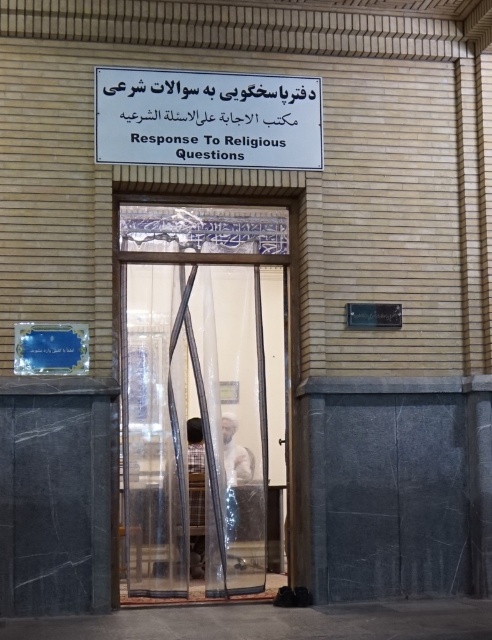
Question: Is transparent mesh door at center to the right of light brown wooden chair at center from the viewer's perspective?

Choices:
 (A) no
 (B) yes

Answer: (B)

Question: Among these points, which one is farthest from the camera?

Choices:
 (A) (234, 435)
 (B) (187, 420)

Answer: (B)

Question: Among these points, which one is nearest to the camera?

Choices:
 (A) (303, 113)
 (B) (236, 301)

Answer: (A)

Question: Among these points, which one is nearest to the camera?

Choices:
 (A) (257, 280)
 (B) (198, 547)
 (C) (320, 122)

Answer: (C)

Question: Is white cotton shirt at center smaller than light brown wooden chair at center?

Choices:
 (A) yes
 (B) no

Answer: (A)

Question: Is white paper sign at center above light brown wooden chair at center?

Choices:
 (A) no
 (B) yes

Answer: (B)